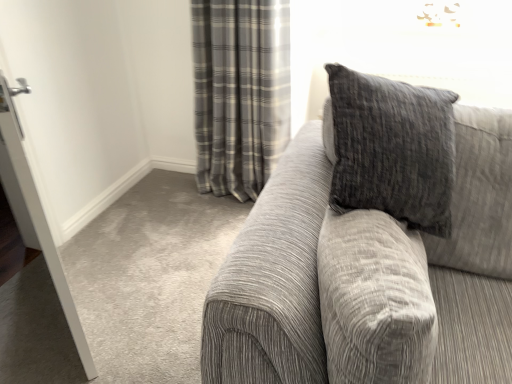
Question: Does point (42, 208) appear closer or farther from the camera than point (240, 69)?

Choices:
 (A) closer
 (B) farther

Answer: (A)

Question: From the image's perspective, is white glossy door at left positioned above or below gray plaid curtain at upper center?

Choices:
 (A) below
 (B) above

Answer: (A)

Question: Based on their relative distances, which object is farther from the gray plaid curtain at upper center?

Choices:
 (A) white glossy door at left
 (B) textured gray couch at right

Answer: (A)

Question: Which object is positioned farthest from the white glossy door at left?

Choices:
 (A) gray plaid curtain at upper center
 (B) textured gray couch at right

Answer: (A)